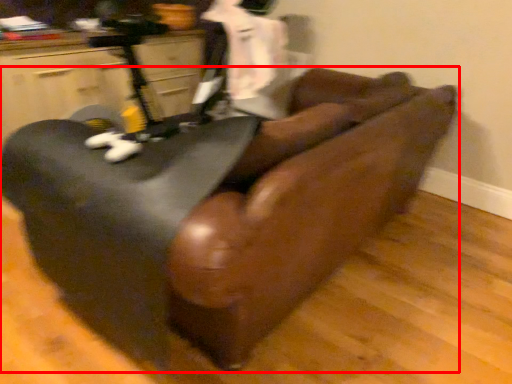
Question: Considering the relative positions of furniture (annotated by the red box) and furniture in the image provided, where is furniture (annotated by the red box) located with respect to the staircase?

Choices:
 (A) right
 (B) left

Answer: (A)